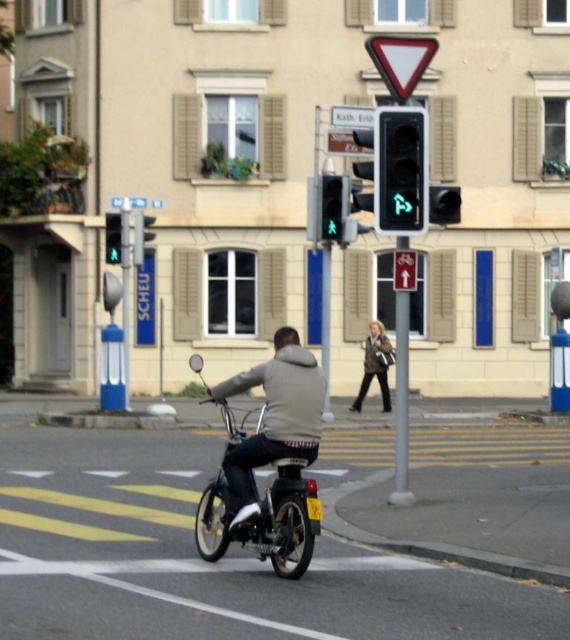
Question: Does dark gray jacket at center have a smaller size compared to white plastic sign at upper center?

Choices:
 (A) yes
 (B) no

Answer: (B)

Question: Which of the following is the farthest from the observer?

Choices:
 (A) (356, 118)
 (B) (331, 136)
 (C) (382, 344)

Answer: (C)

Question: Considering the real-world distances, which object is farthest from the white plastic sign at upper center?

Choices:
 (A) green glass pedestrian signal at center
 (B) metallic reflective yield sign at upper center

Answer: (B)

Question: Where is green glass traffic light at upper center located in relation to green glass pedestrian signal at upper center in the image?

Choices:
 (A) left
 (B) right

Answer: (B)

Question: Among these points, which one is farthest from the camera?

Choices:
 (A) (142, 228)
 (B) (335, 125)

Answer: (A)

Question: Does dark gray jacket at center have a smaller size compared to green glass traffic light at upper center?

Choices:
 (A) no
 (B) yes

Answer: (A)